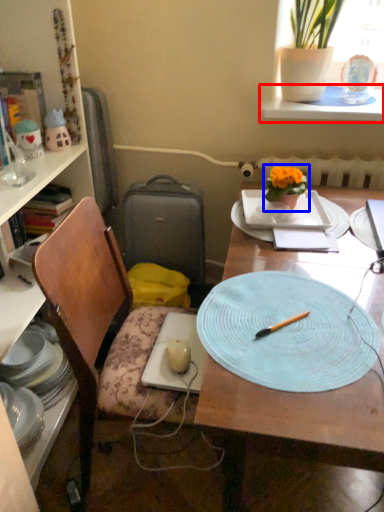
Question: Which object is further to the camera taking this photo, window sill (highlighted by a red box) or houseplant (highlighted by a blue box)?

Choices:
 (A) window sill
 (B) houseplant

Answer: (A)